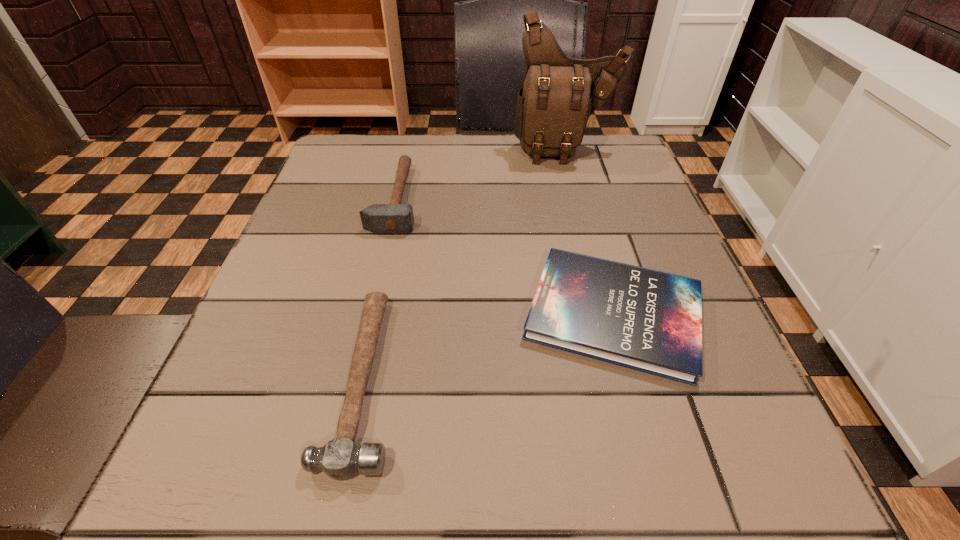
Identify the location of free space that satisfies the following two spatial constraints: 1. on the front-facing side of the farthest object; 2. on the striking surface of the third shortest object. (579, 198).

You are a GUI agent. You are given a task and a screenshot of the screen. Output one action in this format:
    pyautogui.click(x=<x>, y=<y>)
    Task: Click on the vacant space that satisfies the following two spatial constraints: 1. on the striking surface of the taller hammer; 2. on the back side of the hardback book
    
    Given the screenshot: What is the action you would take?
    pyautogui.click(x=369, y=314)

You are a GUI agent. You are given a task and a screenshot of the screen. Output one action in this format:
    pyautogui.click(x=<x>, y=<y>)
    Task: Click on the free space that satisfies the following two spatial constraints: 1. on the striking surface of the farther hammer; 2. on the right side of the shortest object
    This screenshot has height=540, width=960.
    Given the screenshot: What is the action you would take?
    pyautogui.click(x=369, y=314)

At what (x,y) coordinates should I click in order to perform the action: click on free spot that satisfies the following two spatial constraints: 1. on the front-facing side of the tallest object; 2. on the striking surface of the taller hammer. Please return your answer as a coordinate pair (x, y). The width and height of the screenshot is (960, 540). Looking at the image, I should click on (579, 198).

Locate an element on the screen. This screenshot has height=540, width=960. vacant area that satisfies the following two spatial constraints: 1. on the front-facing side of the farthest object; 2. on the striking surface of the second tallest object is located at coordinates (579, 198).

You are a GUI agent. You are given a task and a screenshot of the screen. Output one action in this format:
    pyautogui.click(x=<x>, y=<y>)
    Task: Click on the free location that satisfies the following two spatial constraints: 1. on the front-facing side of the farthest object; 2. on the striking face of the nearer hammer
    
    Given the screenshot: What is the action you would take?
    pyautogui.click(x=627, y=378)